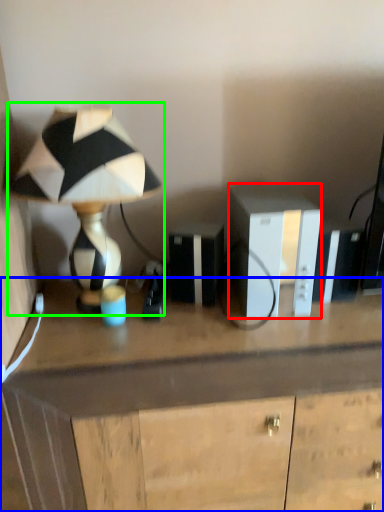
Question: Which object is positioned farthest from cabinetry (highlighted by a red box)? Select from desk (highlighted by a blue box) and lamp (highlighted by a green box).

Choices:
 (A) desk
 (B) lamp

Answer: (B)